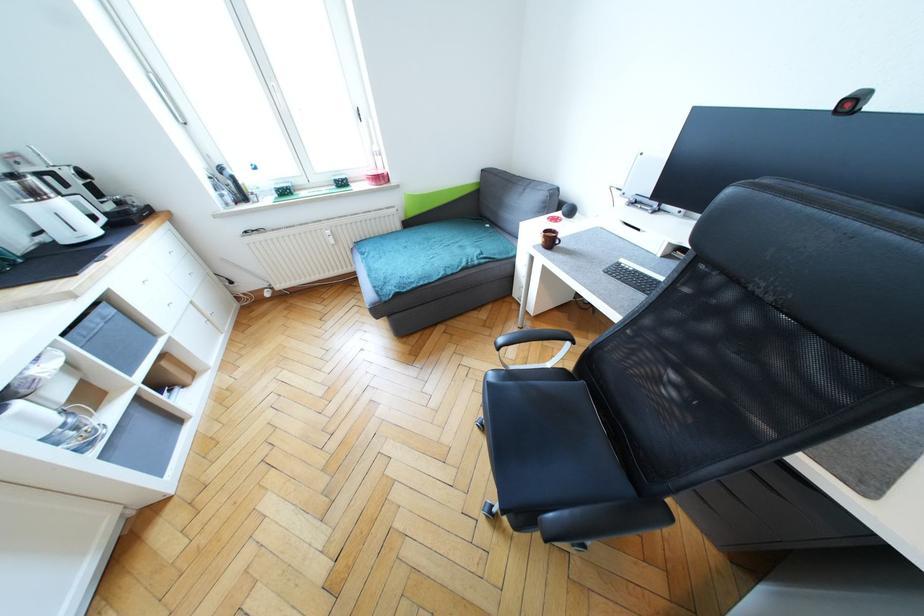
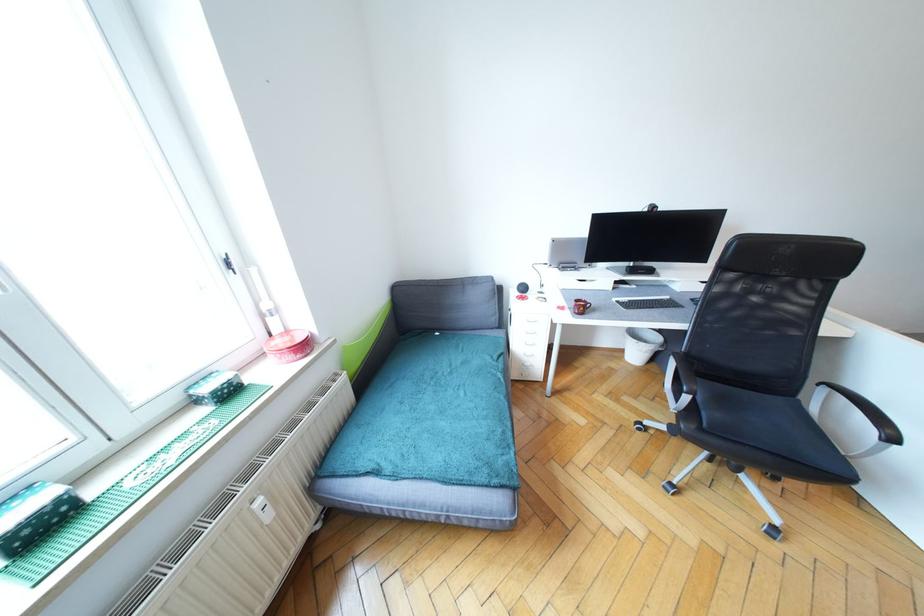
Where in the second image is the point corresponding to (479,264) from the first image?

(504, 367)